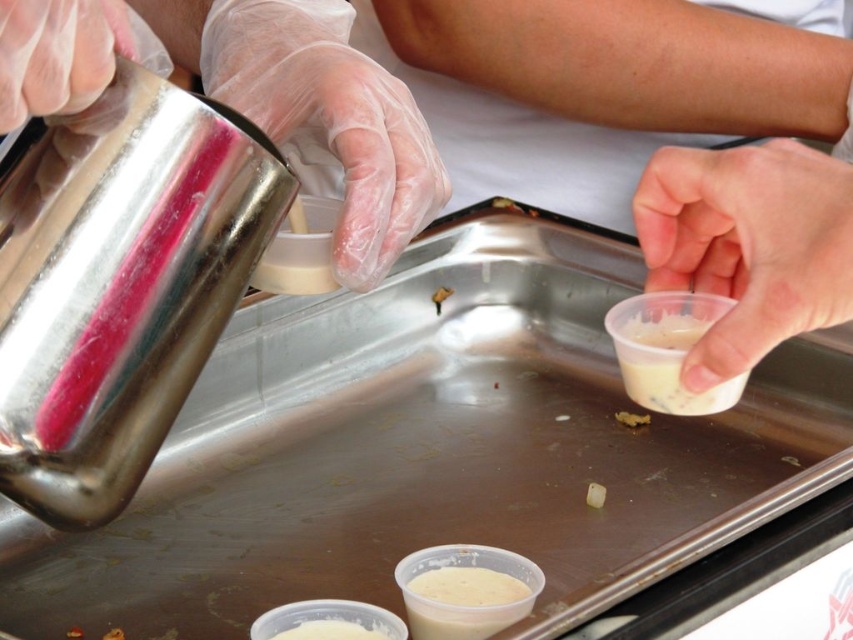
You are a food inspector observing the preparation process. You notice the white creamy substance at lower center and the white matte cube at center. Which object is closer to you in the image?

The white creamy substance at lower center is closer to you because it is in front of the white matte cube at center.

Consider the image. You are a food preparer trying to pour the white creamy substance at lower center into the transparent plastic cup at upper right. Based on their sizes, will the cup be able to hold all the substance without spilling?

The transparent plastic cup at upper right is wider than the white creamy substance at lower center, so it should be able to hold all the substance without spilling.